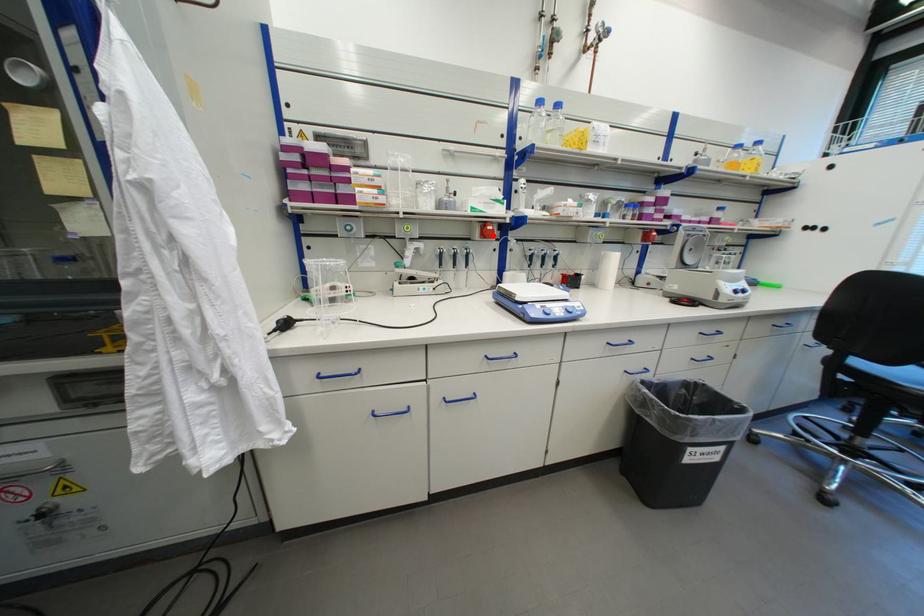
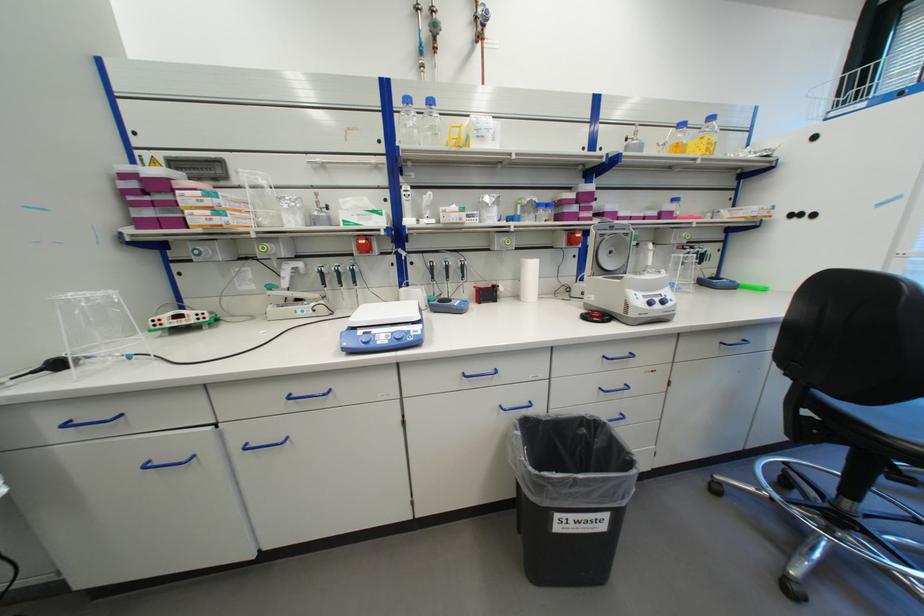
Where in the second image is the point corresponding to the highlighted location from the first image?

(373, 249)